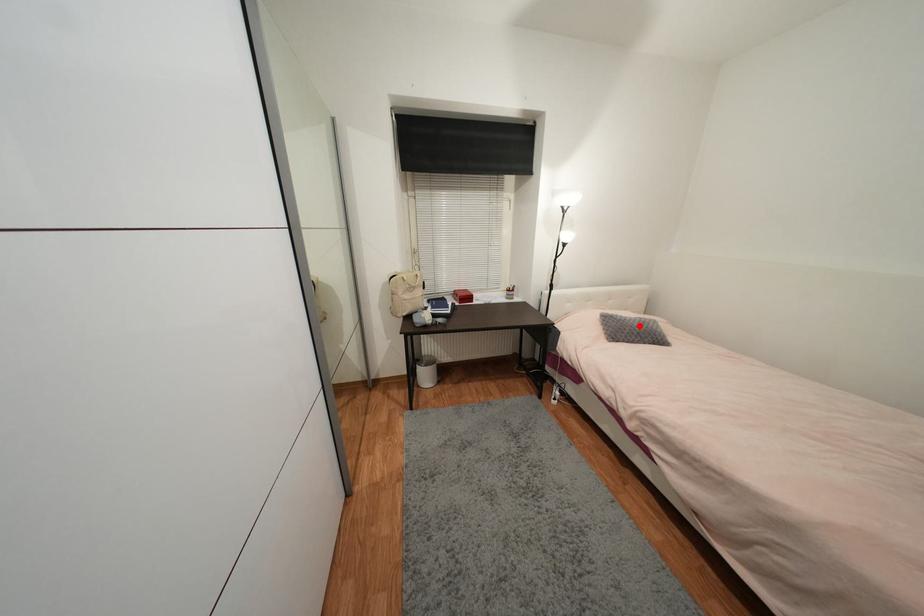
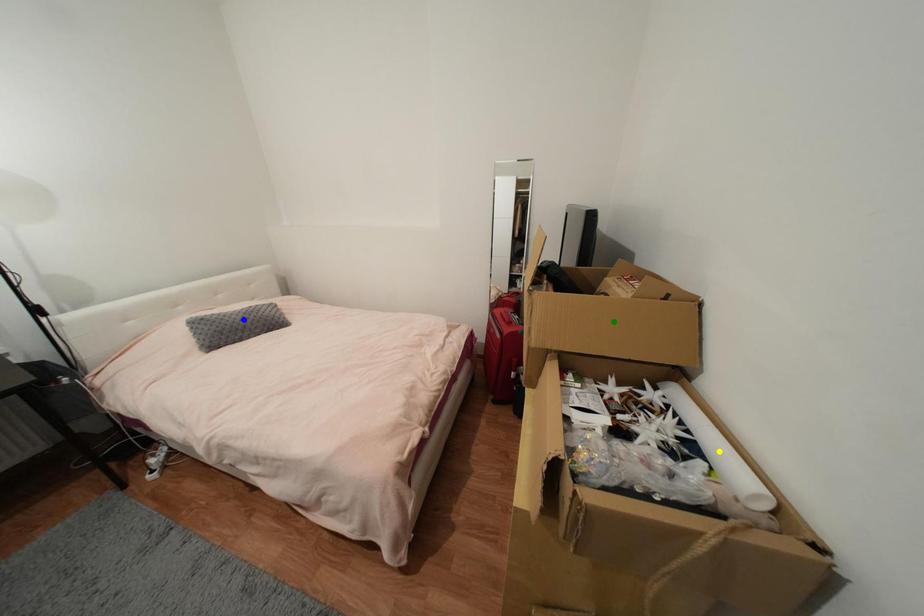
Question: I am providing you with two images of the same scene from different viewpoints. A red point is marked on the first image. You are given multiple points on the second image. Can you choose the point in image 2 that corresponds to the point in image 1?

Choices:
 (A) blue point
 (B) green point
 (C) yellow point

Answer: (A)